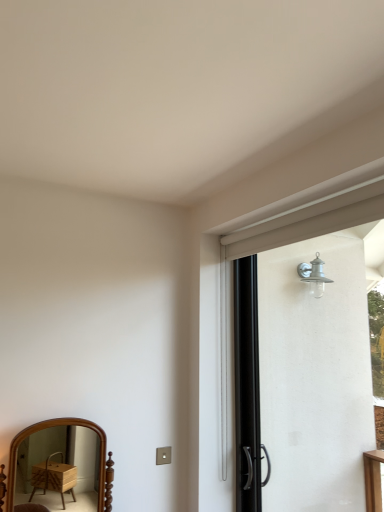
The image size is (384, 512). What do you see at coordinates (59, 468) in the screenshot?
I see `wooden mirror at lower left` at bounding box center [59, 468].

This screenshot has width=384, height=512. Find the location of `wooden mirror at lower left`. wooden mirror at lower left is located at coordinates (59, 468).

Where is `wooden mirror at lower left`? wooden mirror at lower left is located at coordinates (59, 468).